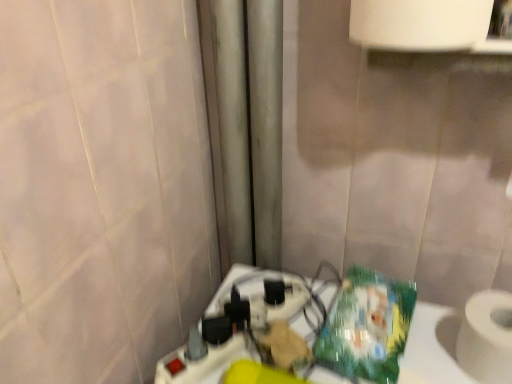
What do you see at coordinates (486, 337) in the screenshot?
I see `white matte toilet paper at lower right` at bounding box center [486, 337].

Image resolution: width=512 pixels, height=384 pixels. I want to click on white matte toilet paper at lower right, so click(486, 337).

Locate an element on the screen. The width and height of the screenshot is (512, 384). white matte toilet paper at lower right is located at coordinates (486, 337).